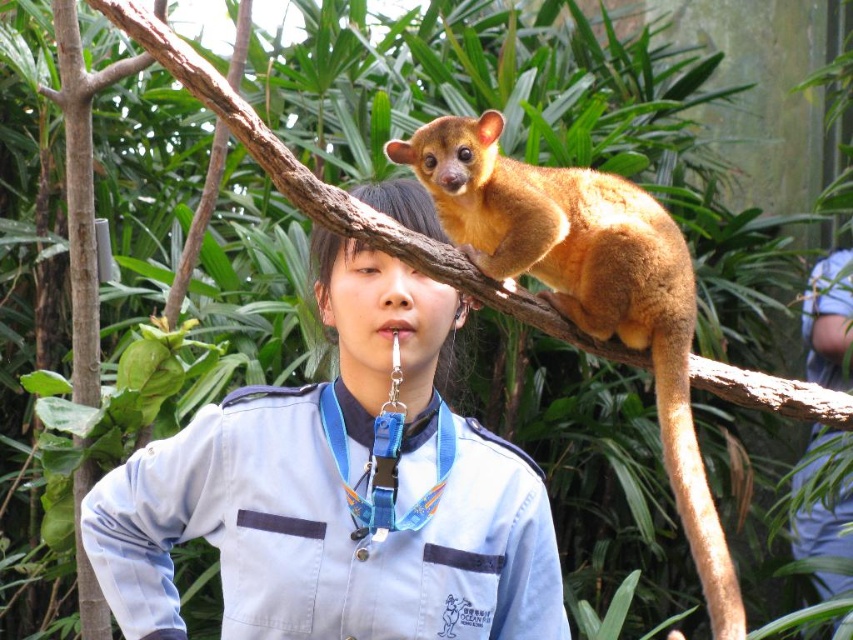
You are a visitor at the zoo and notice a kinkajou in the exhibit. You see the matte brown fur at upper center and the blue lanyard at center. Which object is closer to you?

The matte brown fur at upper center is closer to you because it is in front of the blue lanyard at center.

You are a visitor at the zoo and you see a person in a light blue uniform with a blue lanyard at center and a kinkajou with matte brown fur at upper center. Which object is taller?

The matte brown fur at upper center is taller than the blue lanyard at center.